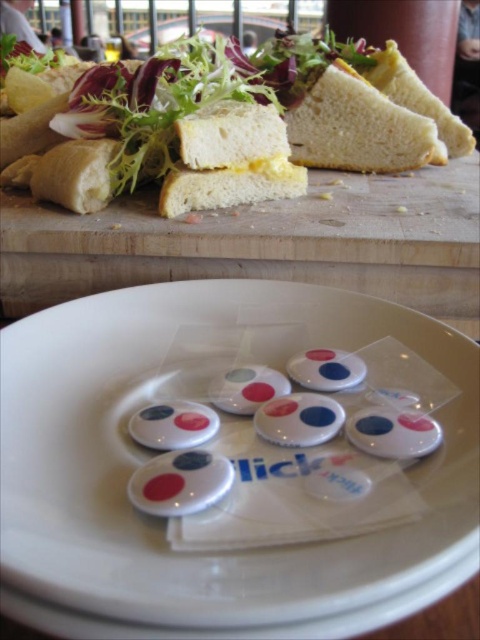
Is white plastic buttons at center shorter than white bread sandwich at upper center?

Indeed, white plastic buttons at center has a lesser height compared to white bread sandwich at upper center.

Does white plastic buttons at center have a greater height compared to white bread sandwich at upper center?

In fact, white plastic buttons at center may be shorter than white bread sandwich at upper center.

The height and width of the screenshot is (640, 480). I want to click on white plastic buttons at center, so click(x=236, y=467).

Can you confirm if white plastic buttons at center is wider than white soft bread at center?

Yes.

Is point (276, 467) in front of point (261, 108)?

That is True.

Is point (243, 316) closer to viewer compared to point (265, 116)?

Yes, point (243, 316) is in front of point (265, 116).

Identify the location of white plastic buttons at center. (236, 467).

In the scene shown: Which is above, white bread sandwich at upper center or white bread at upper right?

Positioned higher is white bread at upper right.

Is white bread sandwich at upper center positioned before white bread at upper right?

Yes.

Between point (419, 134) and point (433, 120), which one is positioned behind?

The point (433, 120) is more distant.

Where is `white bread sandwich at upper center`? white bread sandwich at upper center is located at coordinates (359, 128).